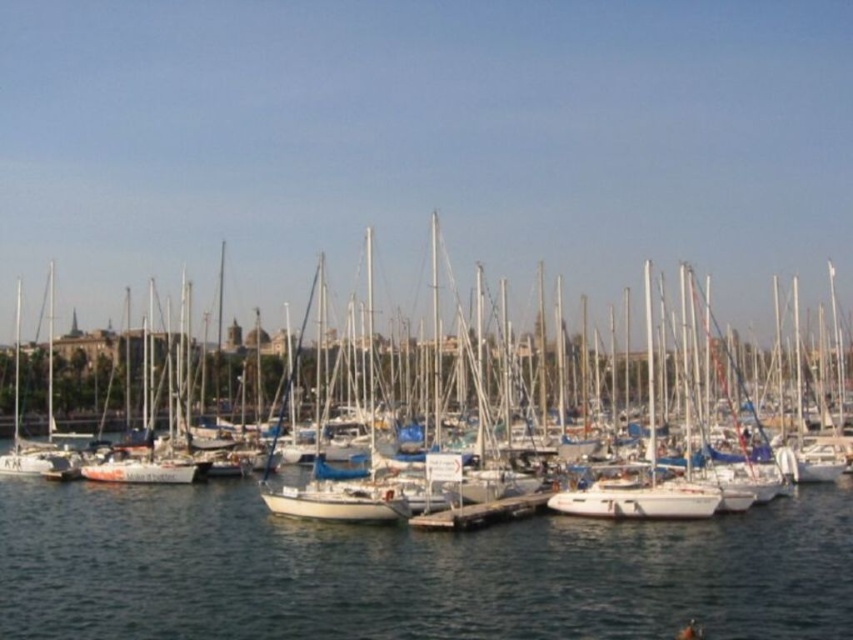
Question: Does white matte sailboat at center have a lesser width compared to smooth concrete dock at center?

Choices:
 (A) no
 (B) yes

Answer: (A)

Question: Which is farther from the clear water at center?

Choices:
 (A) smooth concrete dock at center
 (B) white matte sailboat at center

Answer: (B)

Question: In this image, where is white matte sailboat at center located relative to smooth concrete dock at center?

Choices:
 (A) right
 (B) left

Answer: (B)

Question: Which object appears closest to the camera in this image?

Choices:
 (A) smooth concrete dock at center
 (B) white matte sailboat at center

Answer: (A)

Question: Which point is closer to the camera?

Choices:
 (A) (91, 497)
 (B) (584, 404)

Answer: (A)

Question: Does clear water at center have a smaller size compared to smooth concrete dock at center?

Choices:
 (A) yes
 (B) no

Answer: (B)